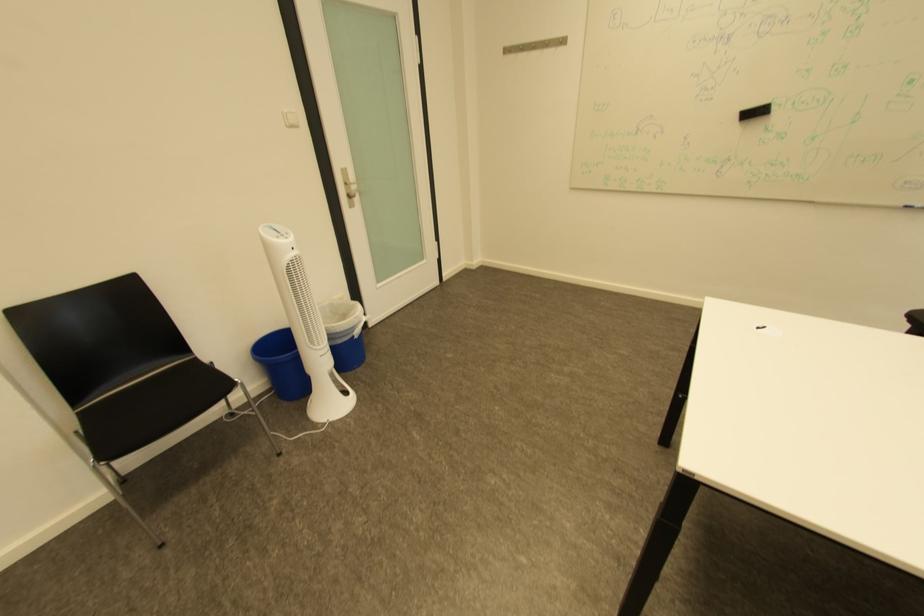
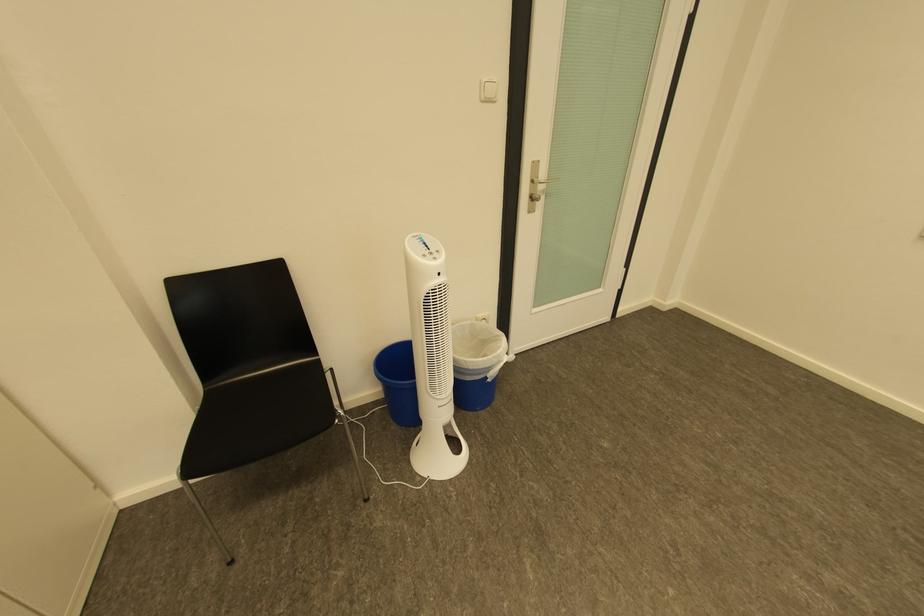
Find the pixel in the second image that matches (x=290, y=243) in the first image.

(439, 262)